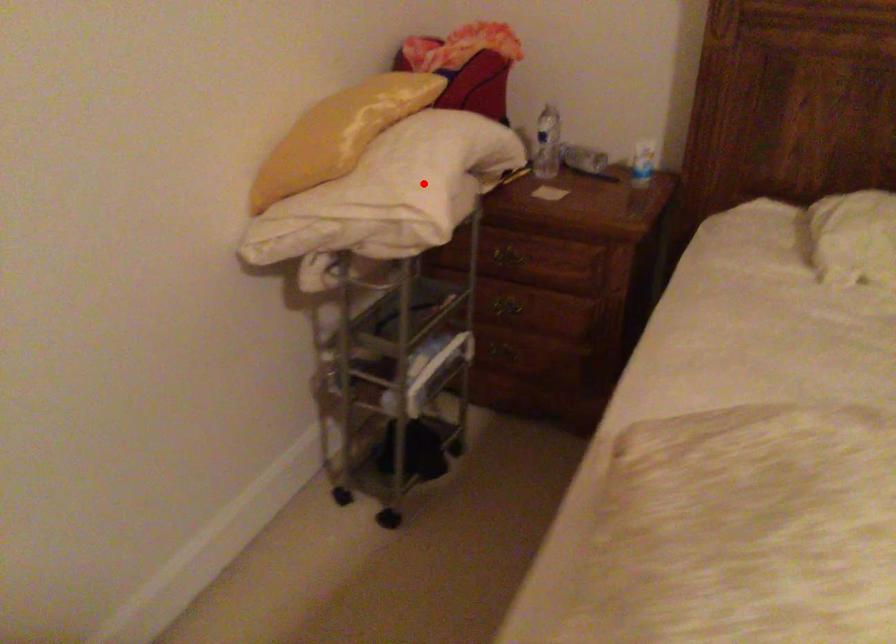
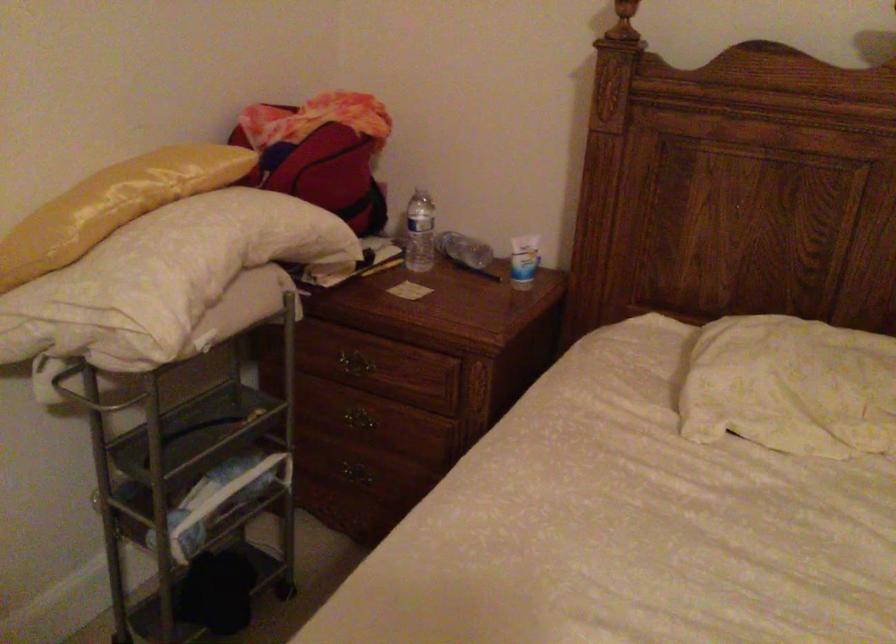
Question: A red point is marked in image1. In image2, is the corresponding 3D point closer to the camera or farther? Reply with the corresponding letter.

Choices:
 (A) The corresponding 3D point is closer.
 (B) The corresponding 3D point is farther.

Answer: (A)